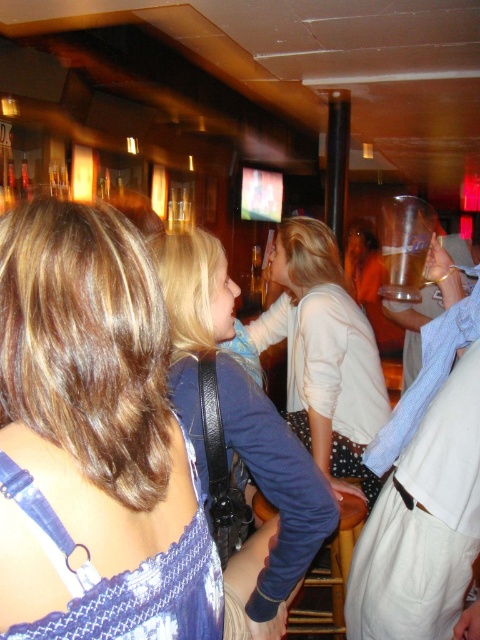
Is blue fabric dress at upper left closer to camera compared to clear plastic cup at upper right?

That is True.

Is point (143, 321) more distant than point (420, 308)?

No, (143, 321) is closer to viewer.

Locate an element on the screen. blue fabric dress at upper left is located at coordinates (95, 438).

Who is higher up, blue fabric dress at upper left or clear plastic cup at center?

clear plastic cup at center

Does blue fabric dress at upper left appear on the right side of clear plastic cup at center?

In fact, blue fabric dress at upper left is to the left of clear plastic cup at center.

I want to click on blue fabric dress at upper left, so click(95, 438).

Consider the image. Who is lower down, blue fabric dress at upper left or white textured sweater at center?

blue fabric dress at upper left is below.

What do you see at coordinates (95, 438) in the screenshot? This screenshot has height=640, width=480. I see `blue fabric dress at upper left` at bounding box center [95, 438].

Locate an element on the screen. The width and height of the screenshot is (480, 640). blue fabric dress at upper left is located at coordinates (95, 438).